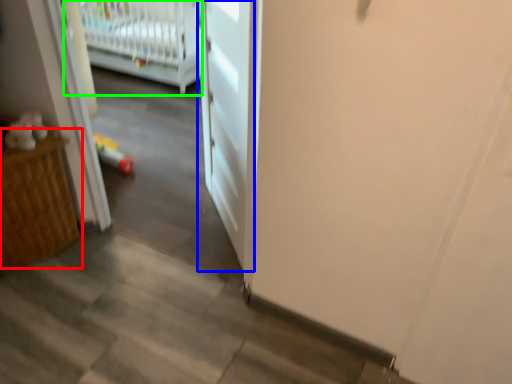
Question: Which is farther away from furniture (highlighted by a red box)? door (highlighted by a blue box) or infant bed (highlighted by a green box)?

Choices:
 (A) door
 (B) infant bed

Answer: (B)